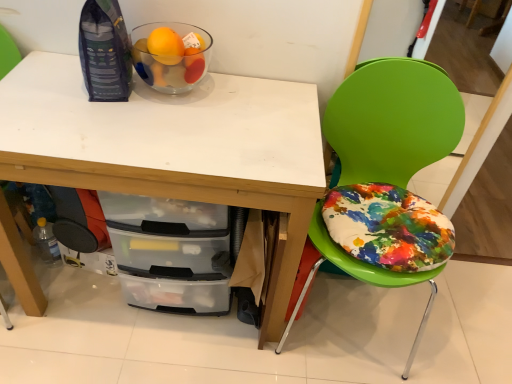
This screenshot has height=384, width=512. I want to click on free space in front of transparent glass bowl at upper left, so click(x=157, y=126).